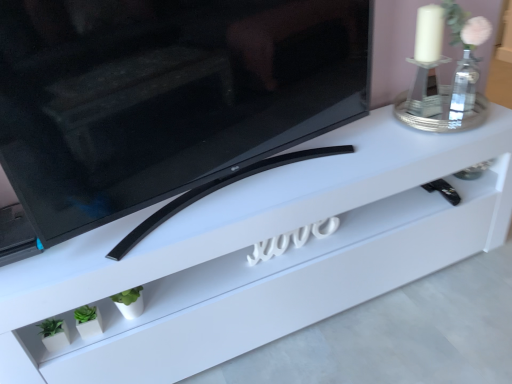
The height and width of the screenshot is (384, 512). What are the coordinates of `free space that is in between black glossy tv at center and white glass candle holder at upper right` in the screenshot? It's located at (351, 158).